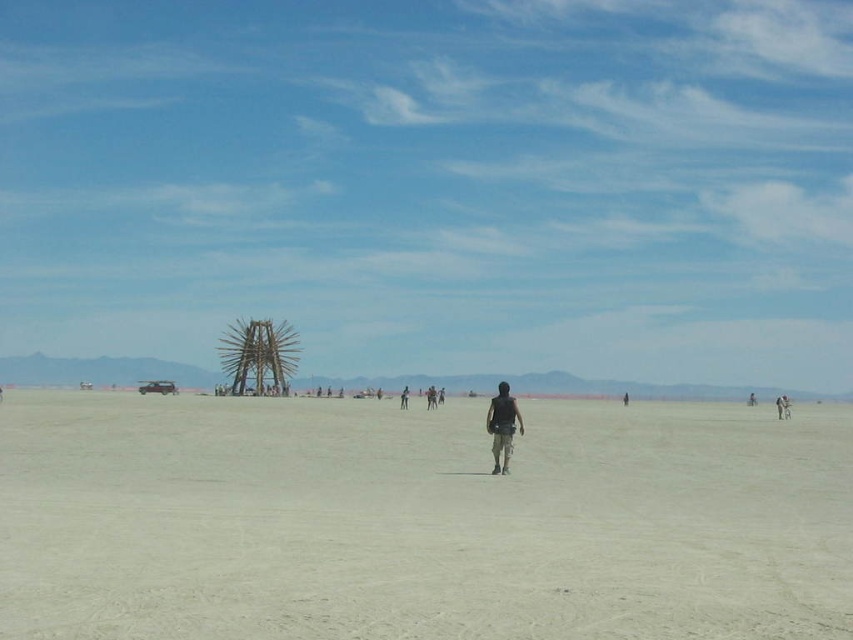
Does light beige sand at center have a greater height compared to dark gray fabric pants at center?

Yes, light beige sand at center is taller than dark gray fabric pants at center.

Is light beige sand at center to the right of dark gray fabric pants at center from the viewer's perspective?

Incorrect, light beige sand at center is not on the right side of dark gray fabric pants at center.

Between point (640, 460) and point (430, 403), which one is positioned behind?

Positioned behind is point (430, 403).

Where is `light beige sand at center`? light beige sand at center is located at coordinates (419, 520).

Is light beige sand at center positioned behind black cotton shirt at center?

No, light beige sand at center is in front of black cotton shirt at center.

Which is behind, point (628, 529) or point (498, 429)?

Point (498, 429)

Who is more forward, (357, 476) or (508, 420)?

Point (357, 476) is in front.

This screenshot has width=853, height=640. What are the coordinates of `light beige sand at center` in the screenshot? It's located at (419, 520).

Does black cotton shirt at center appear on the left side of dark gray fabric pants at center?

In fact, black cotton shirt at center is to the right of dark gray fabric pants at center.

Is point (492, 406) positioned before point (426, 400)?

Yes, it is in front of point (426, 400).

Image resolution: width=853 pixels, height=640 pixels. Find the location of `black cotton shirt at center`. black cotton shirt at center is located at coordinates (502, 426).